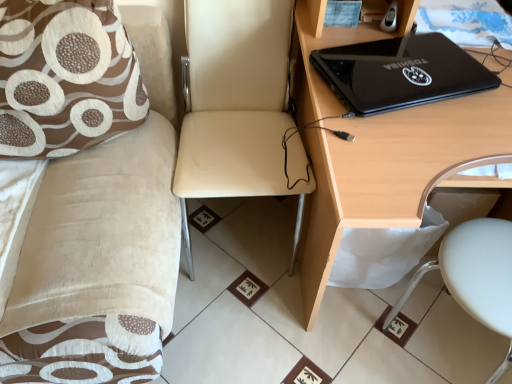
Identify the location of white plastic swivel chair at lower right. This screenshot has height=384, width=512. (475, 276).

I want to click on black glossy laptop at upper right, so click(x=392, y=171).

Measure the distance between point (354, 59) and camera.

Point (354, 59) is 3.58 feet away from camera.

Identify the location of brown fabric pillow at left. The width and height of the screenshot is (512, 384). (65, 77).

I want to click on white plastic swivel chair at lower right, so click(x=475, y=276).

You are a GUI agent. You are given a task and a screenshot of the screen. Output one action in this format:
    pyautogui.click(x=<x>, y=<y>)
    Task: Click on the swivel chair below the black glossy laptop at upper right (from a real-world perspective)
    This screenshot has height=384, width=512.
    Given the screenshot: What is the action you would take?
    pyautogui.click(x=475, y=276)

Can you tell me how much white plastic swivel chair at lower right and black glossy laptop at upper right differ in facing direction?

The angular difference between white plastic swivel chair at lower right and black glossy laptop at upper right is 0.3 degrees.

Is white plastic swivel chair at lower right turned away from black glossy laptop at upper right?

Correct, white plastic swivel chair at lower right is looking away from black glossy laptop at upper right.

From the image's perspective, which object appears higher, white plastic swivel chair at lower right or black glossy laptop at upper right?

black glossy laptop at upper right, from the image's perspective.

Would you say black glossy laptop at upper right is part of black glossy laptop at upper right's contents?

No.

In terms of size, does black glossy laptop at upper right appear bigger or smaller than black glossy laptop at upper right?

black glossy laptop at upper right is smaller than black glossy laptop at upper right.

Is black glossy laptop at upper right next to black glossy laptop at upper right?

Yes, black glossy laptop at upper right is with black glossy laptop at upper right.

The width and height of the screenshot is (512, 384). Identify the location of desk in front of the black glossy laptop at upper right. (392, 171).

Considering the positions of objects black glossy laptop at upper right and beige leather chair at center in the image provided, who is behind, black glossy laptop at upper right or beige leather chair at center?

black glossy laptop at upper right is further away from the camera.

Is beige leather chair at center completely or partially inside black glossy laptop at upper right?

No, beige leather chair at center is not inside black glossy laptop at upper right.

Considering the relative sizes of black glossy laptop at upper right and beige leather chair at center in the image provided, is black glossy laptop at upper right taller than beige leather chair at center?

In fact, black glossy laptop at upper right may be shorter than beige leather chair at center.

Which object is further away from the camera, white plastic swivel chair at lower right or beige fabric couch at upper left?

white plastic swivel chair at lower right is further away from the camera.

Looking at this image, considering the sizes of white plastic swivel chair at lower right and beige fabric couch at upper left in the image, is white plastic swivel chair at lower right wider or thinner than beige fabric couch at upper left?

white plastic swivel chair at lower right is thinner than beige fabric couch at upper left.

Based on the photo, considering the sizes of white plastic swivel chair at lower right and beige fabric couch at upper left in the image, is white plastic swivel chair at lower right taller or shorter than beige fabric couch at upper left?

white plastic swivel chair at lower right is shorter than beige fabric couch at upper left.

Would you say white plastic swivel chair at lower right is a long distance from beige fabric couch at upper left?

They are positioned close to each other.

Between brown fabric pillow at left and white plastic swivel chair at lower right, which one is positioned behind?

Positioned behind is white plastic swivel chair at lower right.

Image resolution: width=512 pixels, height=384 pixels. What are the coordinates of `swivel chair beneath the brown fabric pillow at left (from a real-world perspective)` in the screenshot? It's located at (475, 276).

Are brown fabric pillow at left and white plastic swivel chair at lower right far apart?

Yes, brown fabric pillow at left is far from white plastic swivel chair at lower right.

Is point (6, 127) closer or farther from the camera than point (471, 295)?

Point (6, 127) is farther from the camera than point (471, 295).

In the image, there is a white plastic swivel chair at lower right. At what (x,y) coordinates should I click in order to perform the action: click on chair above it (from the image's perspective). Please return your answer as a coordinate pair (x, y). The width and height of the screenshot is (512, 384). Looking at the image, I should click on (238, 107).

In the scene shown: From a real-world perspective, is beige leather chair at center physically located above or below white plastic swivel chair at lower right?

beige leather chair at center is above white plastic swivel chair at lower right.

Is beige leather chair at center bigger or smaller than white plastic swivel chair at lower right?

Clearly, beige leather chair at center is larger in size than white plastic swivel chair at lower right.

Is beige leather chair at center not inside white plastic swivel chair at lower right?

Absolutely, beige leather chair at center is external to white plastic swivel chair at lower right.

Is brown fabric pillow at left oriented away from beige fabric couch at upper left?

Yes, brown fabric pillow at left is facing away from beige fabric couch at upper left.

Is brown fabric pillow at left with beige fabric couch at upper left?

brown fabric pillow at left and beige fabric couch at upper left are not in contact.

Between brown fabric pillow at left and beige fabric couch at upper left, which one has less height?

brown fabric pillow at left.

Which object is positioned more to the right, brown fabric pillow at left or beige fabric couch at upper left?

brown fabric pillow at left is more to the right.

This screenshot has height=384, width=512. I want to click on swivel chair below the black glossy laptop at upper right (from a real-world perspective), so click(x=475, y=276).

At what (x,y) coordinates should I click in order to perform the action: click on laptop behind the black glossy laptop at upper right. Please return your answer as a coordinate pair (x, y). Looking at the image, I should click on (400, 73).

When comparing their distances from black glossy laptop at upper right, does beige fabric couch at upper left or brown fabric pillow at left seem closer?

Among the two, brown fabric pillow at left is located nearer to black glossy laptop at upper right.

Based on their spatial positions, is white plastic swivel chair at lower right or beige leather chair at center further from brown fabric pillow at left?

Based on the image, white plastic swivel chair at lower right appears to be further to brown fabric pillow at left.

Which object lies further to the anchor point brown fabric pillow at left, black glossy laptop at upper right or beige fabric couch at upper left?

black glossy laptop at upper right lies further to brown fabric pillow at left than the other object.

From the picture: Based on their spatial positions, is black glossy laptop at upper right or beige fabric couch at upper left closer to white plastic swivel chair at lower right?

Among the two, black glossy laptop at upper right is located nearer to white plastic swivel chair at lower right.

Looking at the image, which one is located closer to beige leather chair at center, beige fabric couch at upper left or black glossy laptop at upper right?

Based on the image, beige fabric couch at upper left appears to be nearer to beige leather chair at center.

Estimate the real-world distances between objects in this image. Which object is further from white plastic swivel chair at lower right, brown fabric pillow at left or beige leather chair at center?

brown fabric pillow at left is further to white plastic swivel chair at lower right.

Estimate the real-world distances between objects in this image. Which object is closer to white plastic swivel chair at lower right, black glossy laptop at upper right or beige leather chair at center?

The object closer to white plastic swivel chair at lower right is black glossy laptop at upper right.

Looking at the image, which one is located further to beige leather chair at center, brown fabric pillow at left or black glossy laptop at upper right?

Among the two, brown fabric pillow at left is located further to beige leather chair at center.

Find the location of a particular element. This screenshot has height=384, width=512. pillow between beige fabric couch at upper left and beige leather chair at center from left to right is located at coordinates (65, 77).

Identify the location of pillow between beige fabric couch at upper left and black glossy laptop at upper right from left to right. This screenshot has height=384, width=512. (65, 77).

You are a GUI agent. You are given a task and a screenshot of the screen. Output one action in this format:
    pyautogui.click(x=<x>, y=<y>)
    Task: Click on the laptop between brown fabric pillow at left and white plastic swivel chair at lower right in the horizontal direction
    The image size is (512, 384).
    Given the screenshot: What is the action you would take?
    pyautogui.click(x=400, y=73)

Identify the location of chair between black glossy laptop at upper right and white plastic swivel chair at lower right in the up-down direction. The image size is (512, 384). (238, 107).